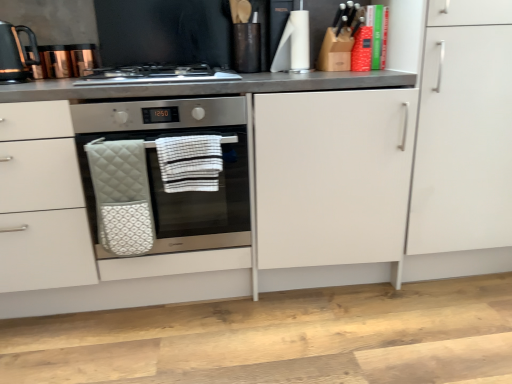
Question: Is white striped fabric hand towel at center, placed as the 2th hand towel when sorted from left to right, oriented away from black glossy kettle at upper left?

Choices:
 (A) no
 (B) yes

Answer: (A)

Question: Is white striped fabric hand towel at center, placed as the 2th hand towel when sorted from left to right, touching black glossy kettle at upper left?

Choices:
 (A) no
 (B) yes

Answer: (A)

Question: Is white striped fabric hand towel at center, placed as the 2th hand towel when sorted from left to right, to the left of black glossy kettle at upper left from the viewer's perspective?

Choices:
 (A) no
 (B) yes

Answer: (A)

Question: Is white striped fabric hand towel at center, arranged as the first hand towel when viewed from the right, closer to the viewer compared to black glossy kettle at upper left?

Choices:
 (A) yes
 (B) no

Answer: (A)

Question: Does white striped fabric hand towel at center, placed as the 2th hand towel when sorted from left to right, have a lesser height compared to black glossy kettle at upper left?

Choices:
 (A) yes
 (B) no

Answer: (A)

Question: Would you say black glossy kettle at upper left is to the left or to the right of quilted white oven mitt at center, which is the 1th hand towel in left-to-right order, in the picture?

Choices:
 (A) right
 (B) left

Answer: (B)

Question: Do you think black glossy kettle at upper left is within quilted white oven mitt at center, arranged as the 2th hand towel when viewed from the right, or outside of it?

Choices:
 (A) inside
 (B) outside

Answer: (B)

Question: Is point (10, 33) positioned closer to the camera than point (110, 246)?

Choices:
 (A) closer
 (B) farther

Answer: (B)

Question: In terms of width, does black glossy kettle at upper left look wider or thinner when compared to quilted white oven mitt at center, which is the 1th hand towel in left-to-right order?

Choices:
 (A) wide
 (B) thin

Answer: (A)

Question: Is stainless steel gas stove at center in front of or behind white matte cabinet at right in the image?

Choices:
 (A) behind
 (B) front

Answer: (A)

Question: In terms of width, does stainless steel gas stove at center look wider or thinner when compared to white matte cabinet at right?

Choices:
 (A) wide
 (B) thin

Answer: (B)

Question: Is stainless steel gas stove at center taller or shorter than white matte cabinet at right?

Choices:
 (A) short
 (B) tall

Answer: (A)

Question: From a real-world perspective, relative to white matte cabinet at right, is stainless steel gas stove at center vertically above or below?

Choices:
 (A) above
 (B) below

Answer: (A)

Question: Which is correct: white striped fabric hand towel at center, placed as the 2th hand towel when sorted from left to right, is inside quilted white oven mitt at center, which is the 1th hand towel in left-to-right order, or outside of it?

Choices:
 (A) outside
 (B) inside

Answer: (A)

Question: Is white striped fabric hand towel at center, arranged as the first hand towel when viewed from the right, to the left or to the right of quilted white oven mitt at center, which is the 1th hand towel in left-to-right order, in the image?

Choices:
 (A) right
 (B) left

Answer: (A)